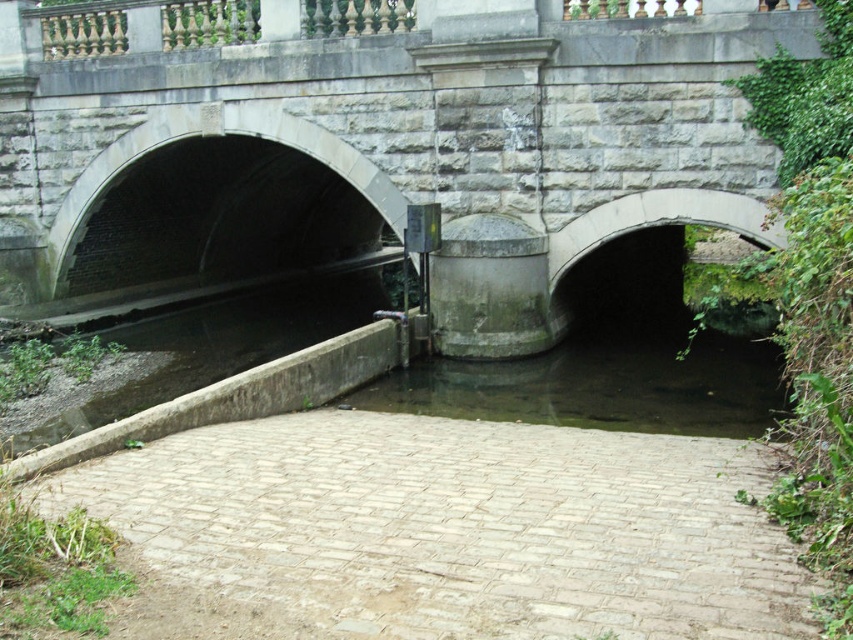
You are a delivery person carrying a large box that is 2 meters wide. You need to cross the stone bridge at center. Can you fit through the bridge based on its width compared to the dark gray concrete water at lower left?

The stone bridge at center is wider than the dark gray concrete water at lower left. Since the bridge is wider, it should be able to accommodate your 2 meter wide box. However, the exact width of the bridge isn not specified, so you may need to check the actual dimensions before proceeding.

You are standing at the entrance of the bridge and want to walk towards the light beige brick path at center. What direction should you move in to reach it?

Since the light beige brick path at center is located at coordinates point [457,525], you should move forward towards the center of the bridge to reach it.